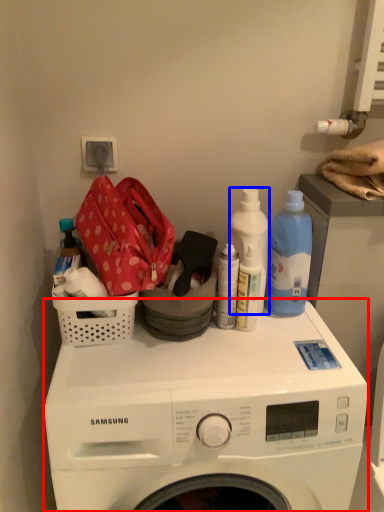
Question: Which of the following is the closest to the observer, washing machine (highlighted by a red box) or cleaning product (highlighted by a blue box)?

Choices:
 (A) washing machine
 (B) cleaning product

Answer: (A)